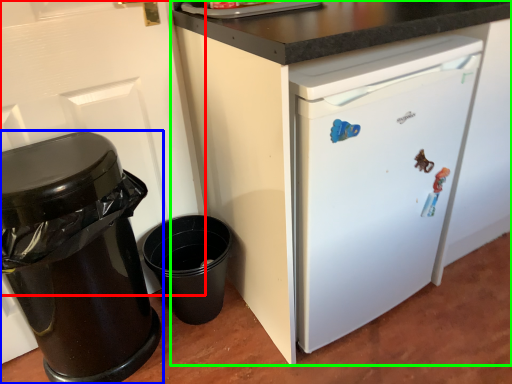
Question: Which object is the closest to the door (highlighted by a red box)? Choose among these: waste container (highlighted by a blue box) or cabinetry (highlighted by a green box).

Choices:
 (A) waste container
 (B) cabinetry

Answer: (A)